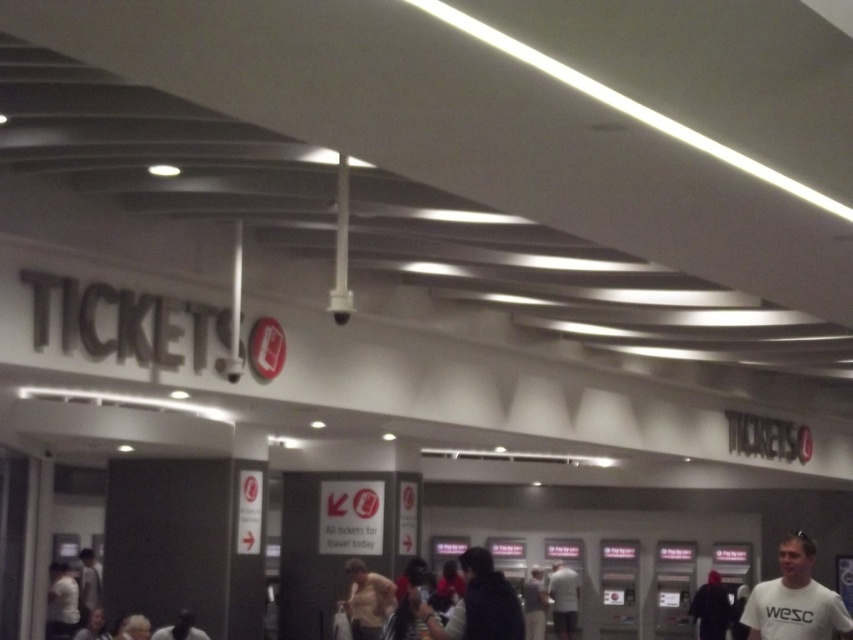
Which is below, light beige shirt at center or white matte shirt at center?

white matte shirt at center is below.

Is the position of light beige shirt at center less distant than that of white matte shirt at center?

Yes, it is.

Identify the location of light beige shirt at center. The width and height of the screenshot is (853, 640). (367, 600).

Is point (393, 604) positioned behind point (94, 579)?

No, (393, 604) is closer to viewer.

Find the location of a particular element. This screenshot has width=853, height=640. light beige shirt at center is located at coordinates (367, 600).

Does white t-shirt at lower right appear on the left side of white matte shirt at center?

Yes, white t-shirt at lower right is to the left of white matte shirt at center.

Who is more distant from viewer, (784,572) or (550,573)?

The point (550,573) is behind.

In the scene shown: Who is more forward, (769, 584) or (575, 598)?

Positioned in front is point (769, 584).

You are a GUI agent. You are given a task and a screenshot of the screen. Output one action in this format:
    pyautogui.click(x=<x>, y=<y>)
    Task: Click on the white t-shirt at lower right
    
    Given the screenshot: What is the action you would take?
    pyautogui.click(x=795, y=600)